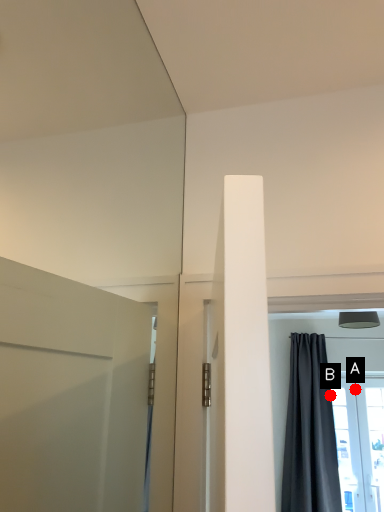
Question: Two points are circled on the image, labeled by A and B beside each circle. Which of the following is the farthest from the observer?

Choices:
 (A) A is further
 (B) B is further

Answer: (A)